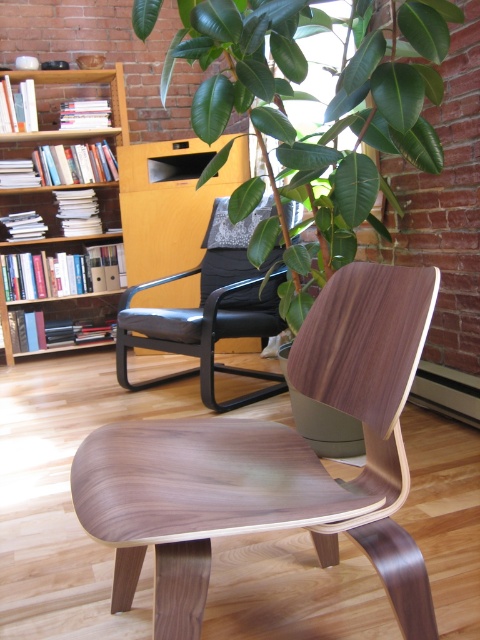
Question: Which point is closer to the camera?

Choices:
 (A) wooden bookshelf at left
 (B) black leather armchair at center

Answer: (B)

Question: Does walnut wood swivel chair at center have a smaller size compared to black leather armchair at center?

Choices:
 (A) yes
 (B) no

Answer: (A)

Question: Which point appears farthest from the camera in this image?

Choices:
 (A) (113, 115)
 (B) (379, 417)
 (C) (207, 285)
 (D) (300, 60)

Answer: (A)

Question: Which of the following is the closest to the observer?

Choices:
 (A) green leafy plant at upper center
 (B) wooden bookshelf at left

Answer: (A)

Question: Does black leather armchair at center appear on the right side of wooden bookshelf at left?

Choices:
 (A) no
 (B) yes

Answer: (B)

Question: Observing the image, what is the correct spatial positioning of green leafy plant at upper center in reference to black leather armchair at center?

Choices:
 (A) left
 (B) right

Answer: (B)